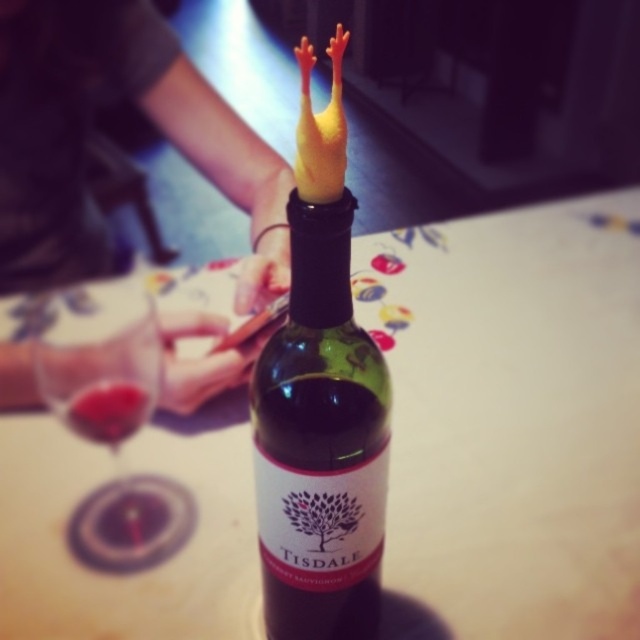
Can you confirm if white glossy table at center is thinner than green matte wine bottle at center?

Incorrect, white glossy table at center's width is not less than green matte wine bottle at center's.

Which of these two, white glossy table at center or green matte wine bottle at center, stands shorter?

green matte wine bottle at center is shorter.

Describe the element at coordinates (509, 419) in the screenshot. This screenshot has height=640, width=640. I see `white glossy table at center` at that location.

Locate an element on the screen. white glossy table at center is located at coordinates (509, 419).

Can you confirm if green matte wine bottle at center is bigger than transparent glass at lower left?

No.

Can you confirm if green matte wine bottle at center is taller than transparent glass at lower left?

Correct, green matte wine bottle at center is much taller as transparent glass at lower left.

Which is behind, point (349, 360) or point (150, 397)?

The point (150, 397) is behind.

The height and width of the screenshot is (640, 640). What are the coordinates of `green matte wine bottle at center` in the screenshot? It's located at (321, 436).

From the picture: Is white glossy table at center bigger than transparent glass at lower left?

Correct, white glossy table at center is larger in size than transparent glass at lower left.

Can you confirm if white glossy table at center is shorter than transparent glass at lower left?

No, white glossy table at center is not shorter than transparent glass at lower left.

Is point (42, 602) positioned after point (150, 390)?

That is False.

Locate an element on the screen. white glossy table at center is located at coordinates (509, 419).